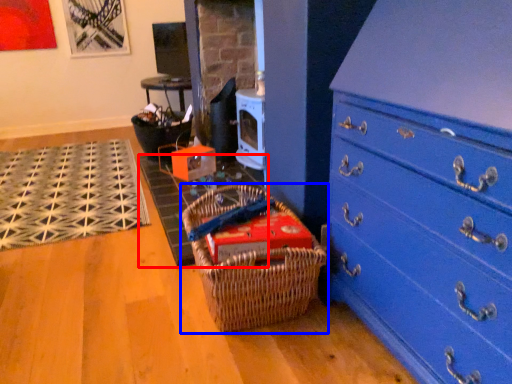
Question: Which object is further to the camera taking this photo, doormat (highlighted by a red box) or picnic basket (highlighted by a blue box)?

Choices:
 (A) doormat
 (B) picnic basket

Answer: (A)